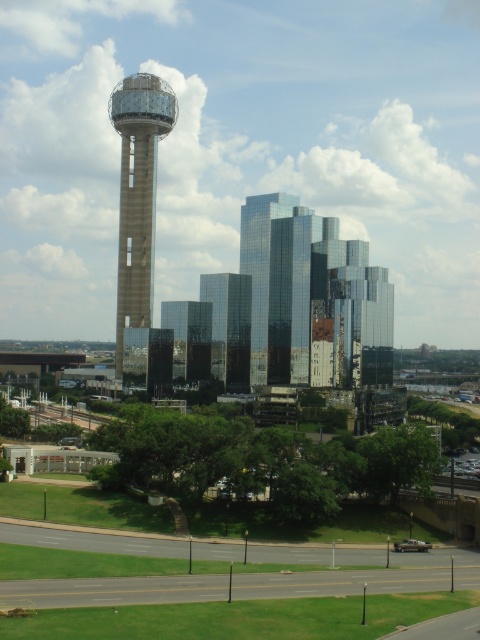
Looking at this image, can you confirm if stone tower at center is positioned above glassy reflective skyscraper at center?

Yes.

Who is positioned more to the right, stone tower at center or glassy reflective skyscraper at center?

glassy reflective skyscraper at center

Is point (126, 134) farther from viewer compared to point (247, 348)?

Yes.

Where is `stone tower at center`? This screenshot has width=480, height=640. stone tower at center is located at coordinates pos(137,193).

Is shiny glass skyscraper at center bigger than glassy reflective skyscraper at center?

Indeed, shiny glass skyscraper at center has a larger size compared to glassy reflective skyscraper at center.

Is point (252, 230) positioned behind point (204, 294)?

No, it is not.

The width and height of the screenshot is (480, 640). What are the coordinates of `shiny glass skyscraper at center` in the screenshot? It's located at (260, 268).

Can you confirm if stone tower at center is positioned to the right of shiny glass skyscraper at center?

Incorrect, stone tower at center is not on the right side of shiny glass skyscraper at center.

Can you confirm if stone tower at center is positioned below shiny glass skyscraper at center?

Incorrect, stone tower at center is not positioned below shiny glass skyscraper at center.

Is point (113, 99) positioned before point (259, 326)?

No, it is not.

This screenshot has height=640, width=480. I want to click on stone tower at center, so click(137, 193).